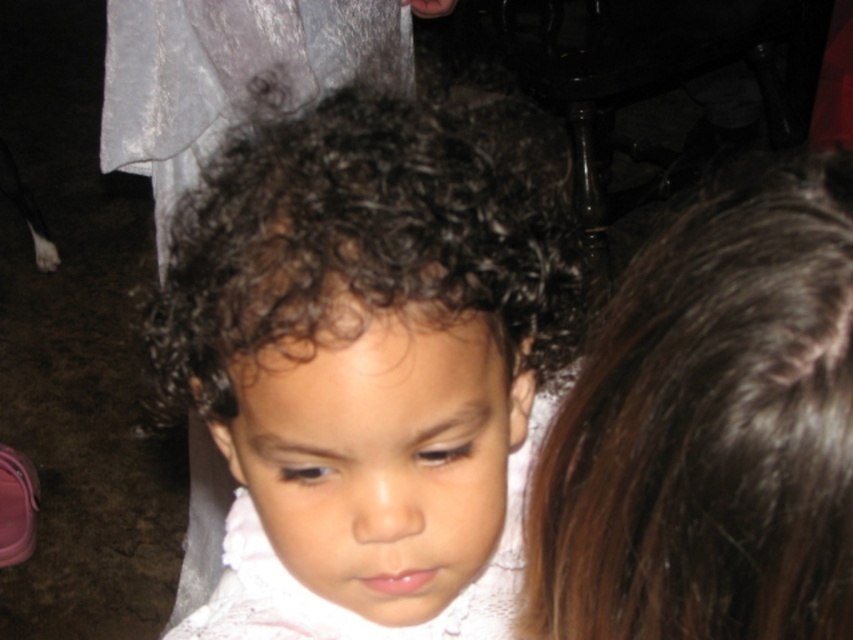
Question: Which of the following is the farthest from the observer?

Choices:
 (A) (525, 467)
 (B) (802, 253)
 (C) (473, 566)

Answer: (A)

Question: Can you confirm if brown silky hair at upper right is positioned above white lace dress at center?

Choices:
 (A) yes
 (B) no

Answer: (A)

Question: Is dark curly hair at center thinner than white lace dress at center?

Choices:
 (A) yes
 (B) no

Answer: (A)

Question: Among these points, which one is nearest to the camera?

Choices:
 (A) (166, 333)
 (B) (822, 204)

Answer: (B)

Question: Does dark curly hair at center have a lesser width compared to brown silky hair at upper right?

Choices:
 (A) yes
 (B) no

Answer: (B)

Question: Based on their relative distances, which object is nearer to the dark curly hair at center?

Choices:
 (A) white lace dress at center
 (B) brown silky hair at upper right

Answer: (A)